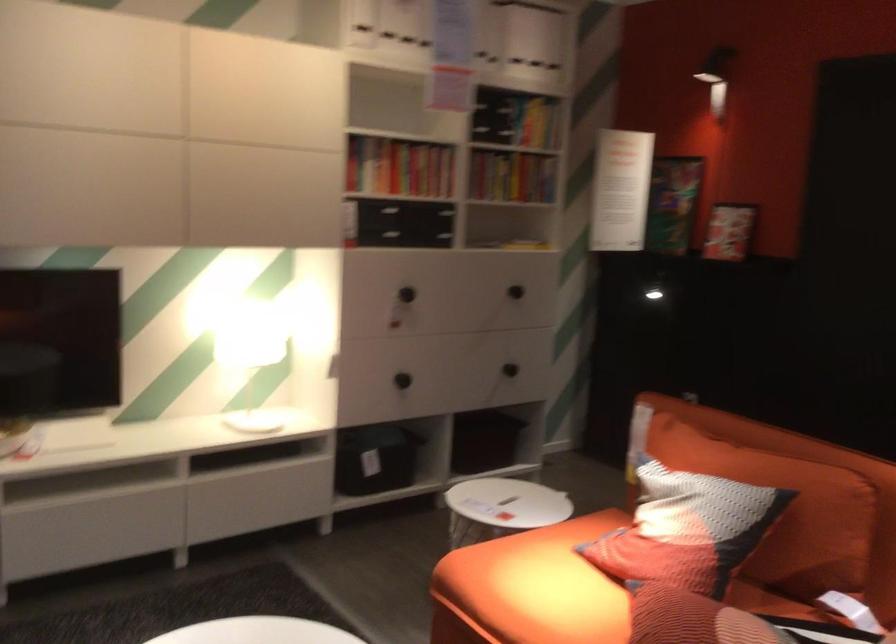
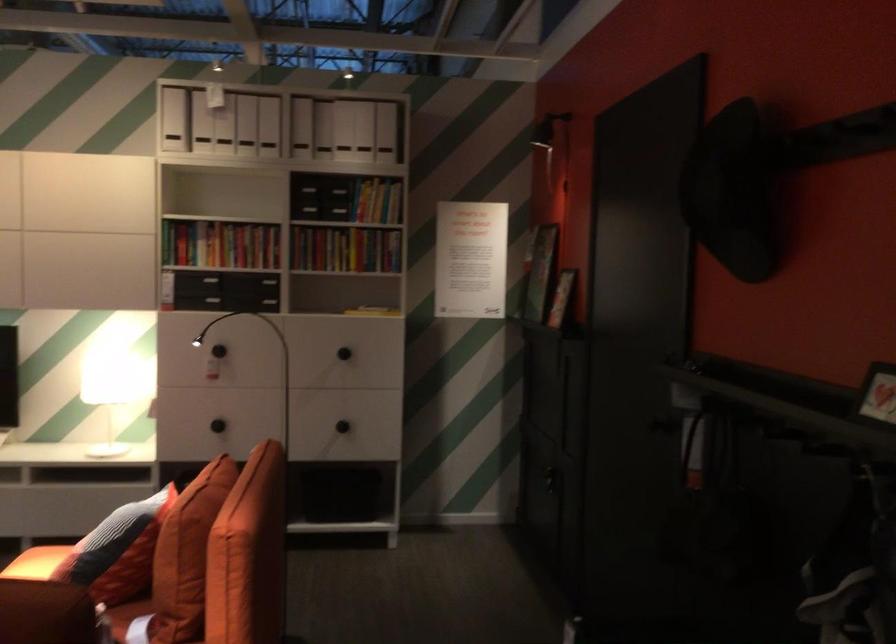
The point at (650, 178) is marked in the first image. Where is the corresponding point in the second image?

(470, 259)